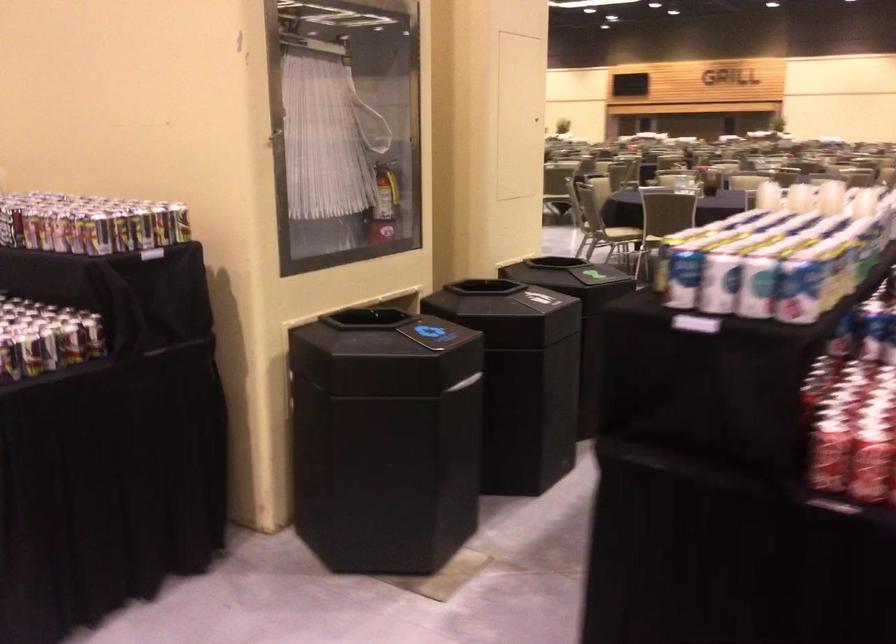
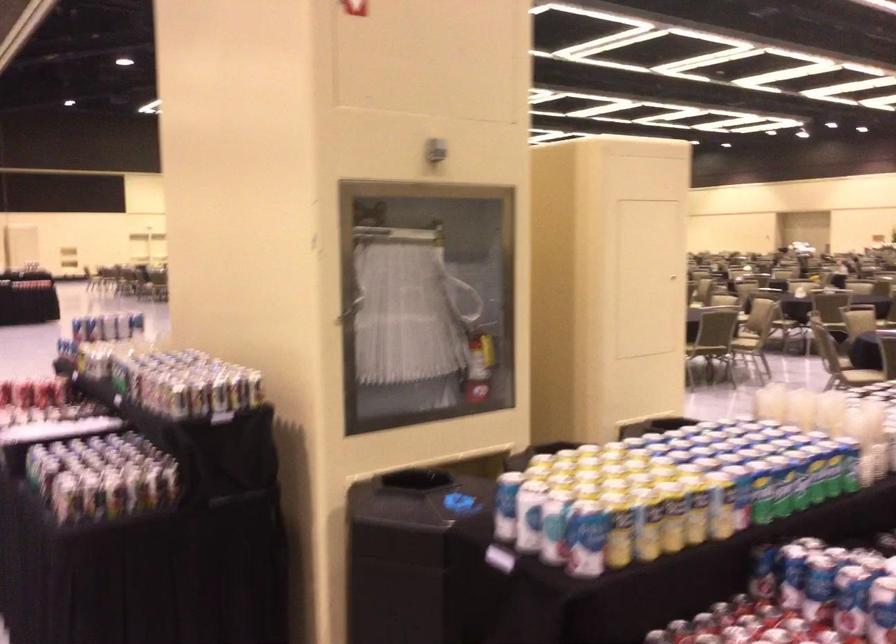
Locate, in the second image, the point that corresponds to the point at 411,330 in the first image.

(442, 502)